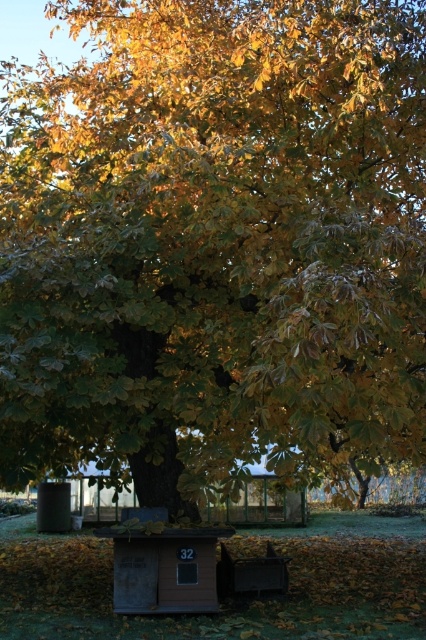
You are standing at the point labeled as point (163, 564) in the image. Which object is directly in front of you?

The wooden hut at lower center is directly in front of you at point (163, 564).

You are standing in front of the autumnal scene with the large tree and the small wooden structure. There are two points marked in the image. Which point, point (213,570) or point (221,557), is closer to you?

Point (213,570) is closer to the viewer than point (221,557).